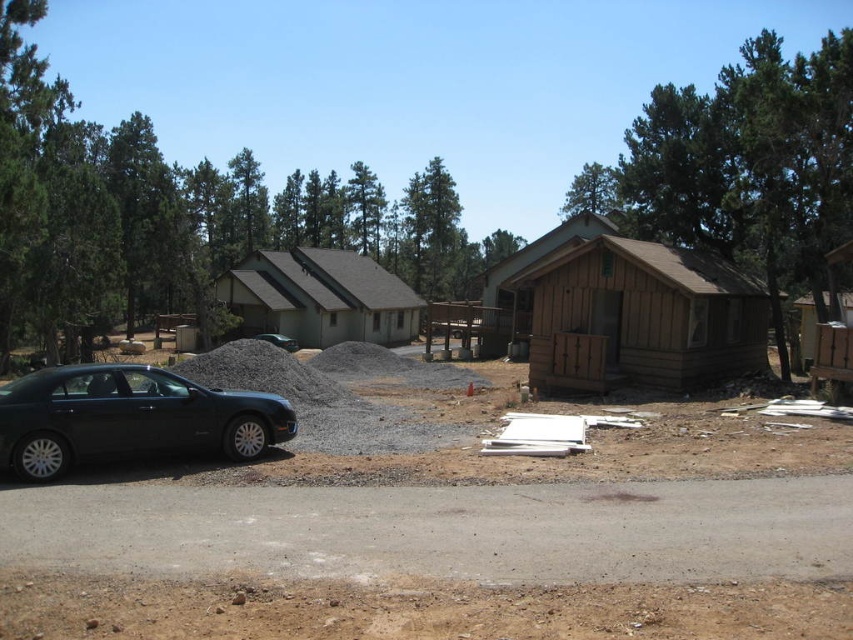
Looking at this image, is brown wooden cabin at center closer to camera compared to green matte car at center?

Yes, brown wooden cabin at center is closer to the viewer.

Is brown wooden cabin at center to the right of green matte car at center from the viewer's perspective?

Yes, brown wooden cabin at center is to the right of green matte car at center.

You are a GUI agent. You are given a task and a screenshot of the screen. Output one action in this format:
    pyautogui.click(x=<x>, y=<y>)
    Task: Click on the brown wooden cabin at center
    
    Given the screenshot: What is the action you would take?
    pyautogui.click(x=523, y=273)

Find the location of a particular element. The width and height of the screenshot is (853, 640). brown wooden cabin at center is located at coordinates (523, 273).

Is brown wooden cabin at center-right positioned behind green shingled cabin at center?

No, it is not.

Is brown wooden cabin at center-right positioned before green shingled cabin at center?

Yes, brown wooden cabin at center-right is closer to the viewer.

Is point (723, 291) in front of point (218, 280)?

Yes, point (723, 291) is in front of point (218, 280).

You are a GUI agent. You are given a task and a screenshot of the screen. Output one action in this format:
    pyautogui.click(x=<x>, y=<y>)
    Task: Click on the brown wooden cabin at center-right
    
    Given the screenshot: What is the action you would take?
    pyautogui.click(x=630, y=310)

Is gray gravel pile at center below green matte car at center?

Yes.

Is point (218, 378) less distant than point (262, 333)?

Yes, it is.

Is point (248, 355) more distant than point (294, 342)?

No.

Image resolution: width=853 pixels, height=640 pixels. Identify the location of gray gravel pile at center. (263, 372).